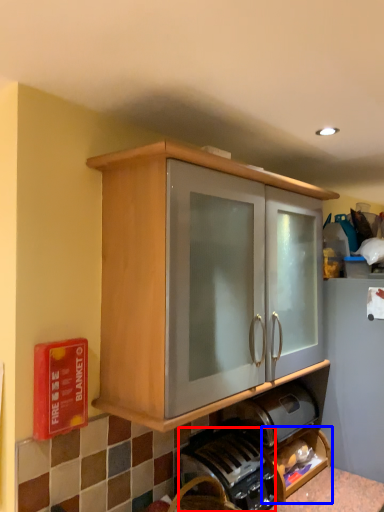
Question: Which point is further to the camera, coffee machine (highlighted by a red box) or shelf (highlighted by a blue box)?

Choices:
 (A) coffee machine
 (B) shelf

Answer: (B)